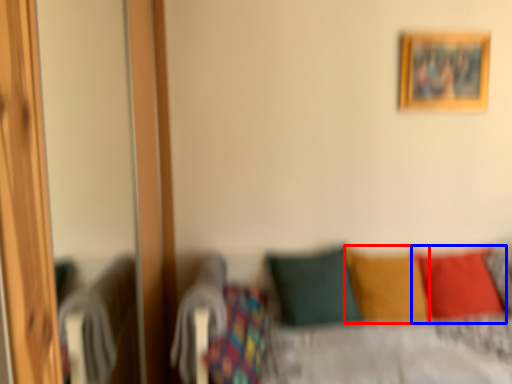
Question: Which object is further to the camera taking this photo, pillow (highlighted by a red box) or pillow (highlighted by a blue box)?

Choices:
 (A) pillow
 (B) pillow

Answer: (B)